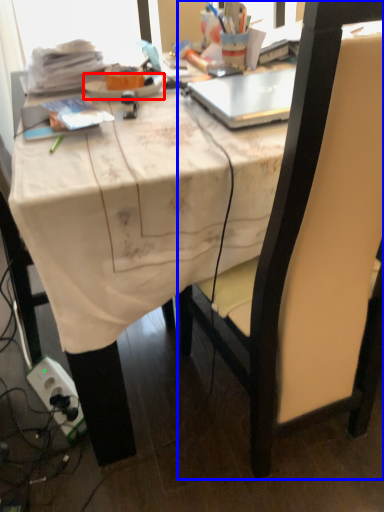
Question: Which of the following is the farthest to the observer, plate (highlighted by a red box) or chair (highlighted by a blue box)?

Choices:
 (A) plate
 (B) chair

Answer: (A)